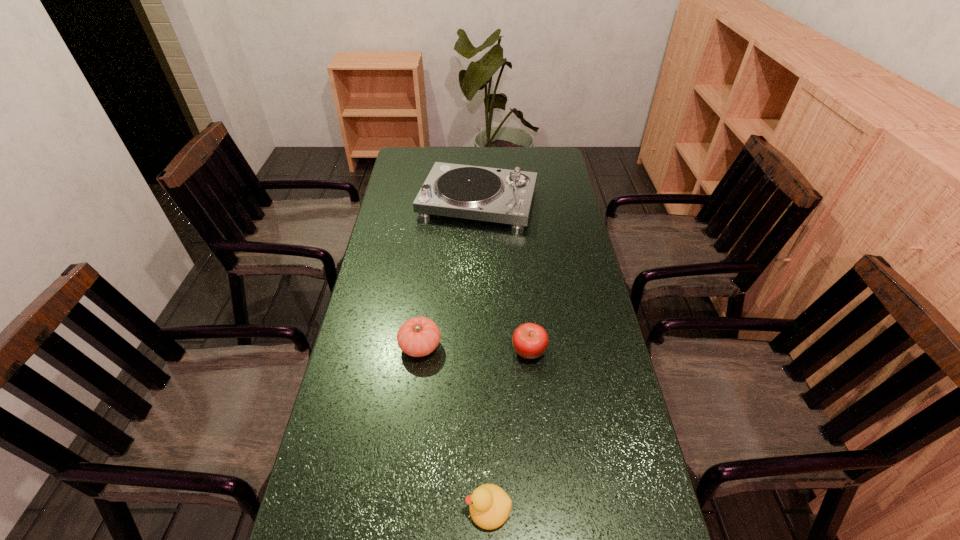
Where is `vacant region located on the face of the duckling`? This screenshot has height=540, width=960. vacant region located on the face of the duckling is located at coordinates (366, 509).

What are the coordinates of `record player positioned at the left edge` in the screenshot? It's located at (505, 196).

The image size is (960, 540). I want to click on tomato that is positioned at the left edge, so click(x=419, y=336).

Where is `object that is at the right edge`? Image resolution: width=960 pixels, height=540 pixels. object that is at the right edge is located at coordinates (505, 196).

I want to click on vacant space at the far edge, so click(x=468, y=153).

Image resolution: width=960 pixels, height=540 pixels. I want to click on vacant area at the left edge, so click(408, 228).

Locate an element on the screen. This screenshot has height=540, width=960. free space at the right edge of the desktop is located at coordinates (558, 181).

In the image, there is a desktop. What are the coordinates of `vacant space at the far left corner` in the screenshot? It's located at (427, 147).

Locate an element on the screen. free space at the far right corner is located at coordinates (528, 171).

The width and height of the screenshot is (960, 540). Find the location of `empty space that is in between the farthest object and the tomato`. empty space that is in between the farthest object and the tomato is located at coordinates (449, 274).